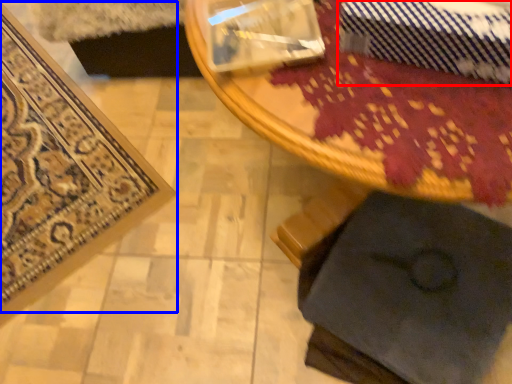
Question: Which object appears closest to the camera in this image, tie (highlighted by a red box) or mat (highlighted by a blue box)?

Choices:
 (A) tie
 (B) mat

Answer: (A)